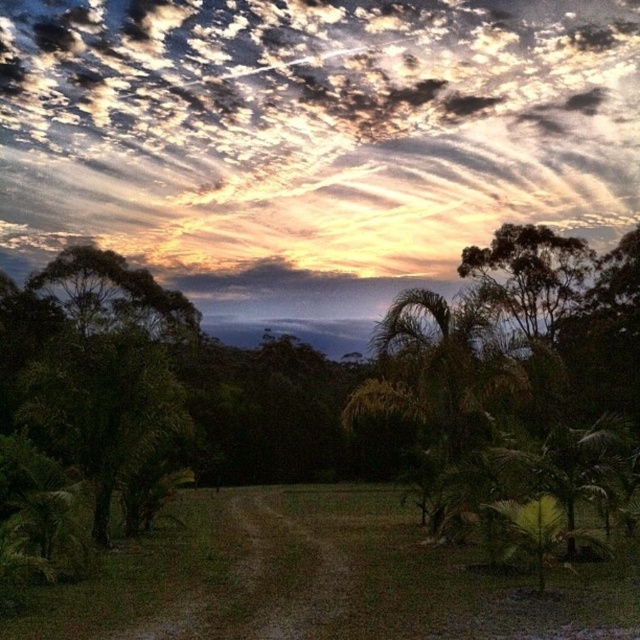
You are an artist sketching the landscape and want to place the green leafy palm at center accurately. According to the coordinates provided, where should you position it on your canvas?

The green leafy palm at center should be positioned at coordinates 0.586 along the x axis and 0.811 along the y axis.

You are standing in the landscape scene and want to take a photo of the cloudy sky at upper center and the green leafy tree at left. Which object will appear closer to the camera in the photo?

The cloudy sky at upper center will appear closer to the camera in the photo because it is further to the viewer than the green leafy tree at left, meaning it is positioned in front of the tree in the scene.